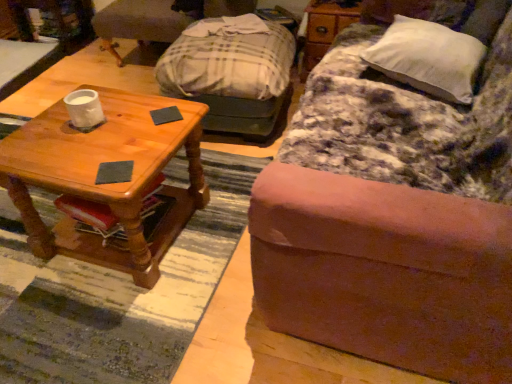
The height and width of the screenshot is (384, 512). What are the coordinates of `blank space to the left of dark gray matte coaster at center, the 2th pad in the front-to-back sequence` in the screenshot? It's located at (124, 116).